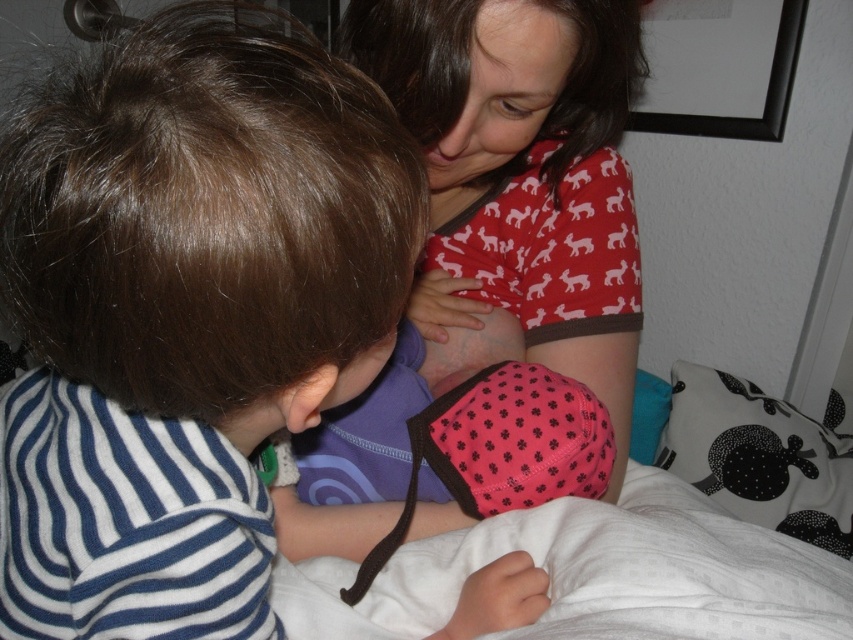
You are organizing a charity event and need to decide which item to donate first based on size. Which item is bigger, the matte red shirt at upper center or the teal fabric pillow at lower right?

The matte red shirt at upper center has a larger size compared to the teal fabric pillow at lower right, so the matte red shirt at upper center is bigger and should be considered first for donation based on size.

You are standing in the room and want to reach the point marked as point [403,344]. If your arm can extend 28 inches, can you reach it without moving your feet?

The distance between you and point [403,344] is 30.78 inches, which is beyond your arm reach of 28 inches. You cannot reach it without moving your feet.

You are a photographer trying to capture a closeup of the teal fabric pillow at lower right without including the matte red shirt at upper center in the frame. Based on their positions, is this possible?

The matte red shirt at upper center is to the left of the teal fabric pillow at lower right, so if you position your camera to focus on the teal fabric pillow at lower right and avoid capturing the left side of the frame, it should be possible to exclude the matte red shirt at upper center from the photo.